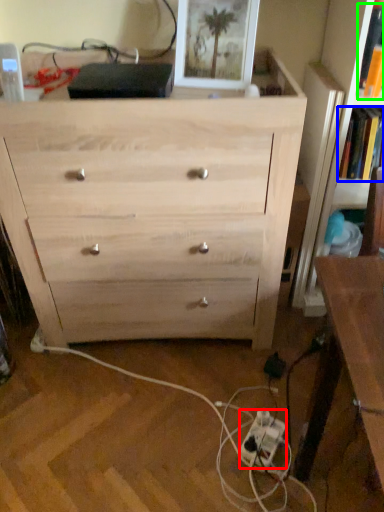
Question: Considering the real-world distances, which object is closest to extension cord (highlighted by a red box)? book (highlighted by a blue box) or book (highlighted by a green box).

Choices:
 (A) book
 (B) book

Answer: (A)